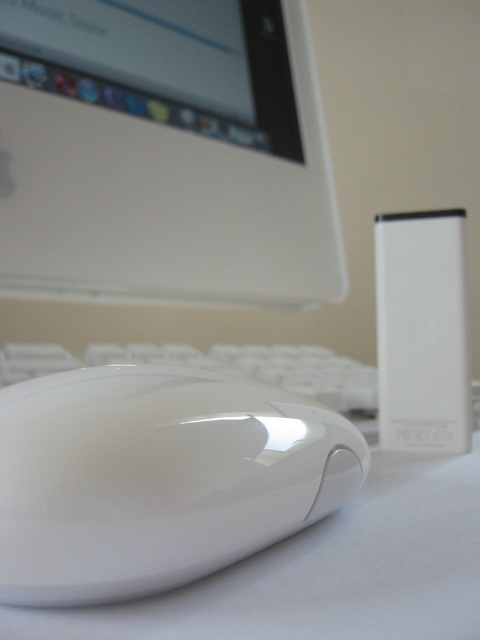
You are setting up a new desk and want to place the white glossy mouse at center and the white matte keyboard at center such that they are exactly 20 inches apart. Based on the current setup, do you need to move them closer or farther apart to achieve this desired distance?

The current distance between the white glossy mouse at center and the white matte keyboard at center is 18.60 inches. To reach the desired 20 inches, you need to move them farther apart by approximately 1.4 inches.

You are organizing cables in a workspace and need to route them from the white matte keyboard at center to the white glossy computer monitor at upper left. Which object should you place the cables closer to, considering their positions?

The white glossy computer monitor at upper left is closer to the viewer than the white matte keyboard at center, so you should place the cables closer to the white glossy computer monitor at upper left to maintain accessibility.